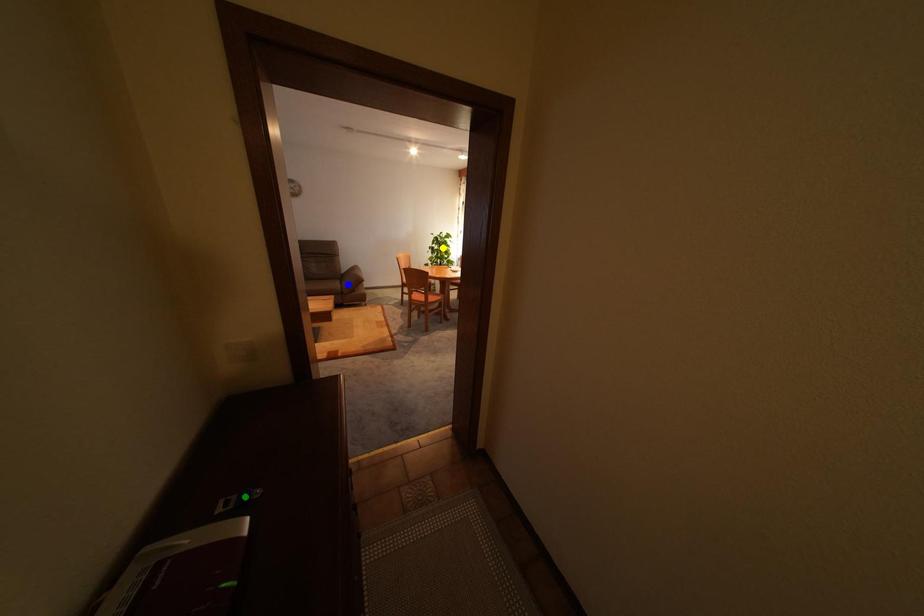
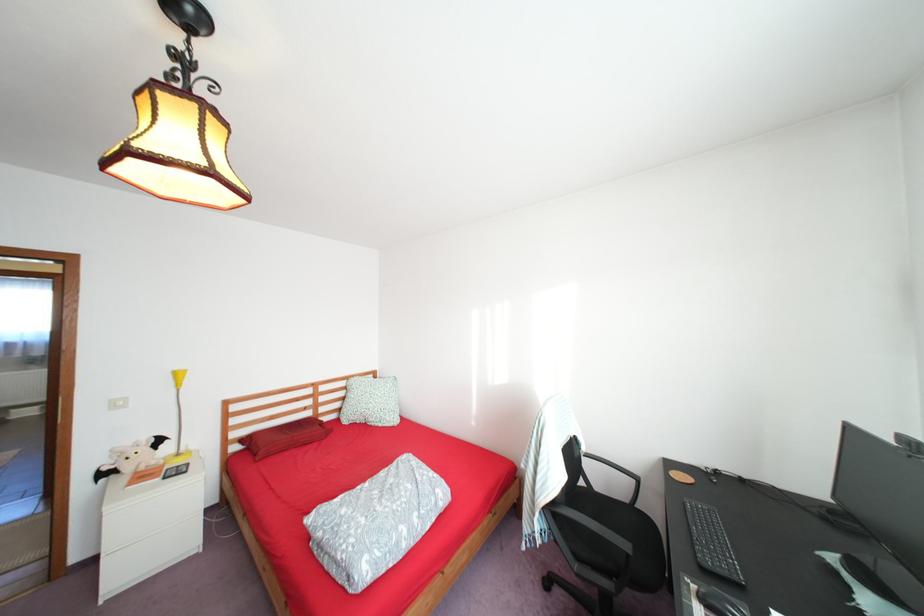
I am providing you with two images of the same scene from different viewpoints. Three points are marked in image1. Which point corresponds to a part or object that is occluded in image2?In image1, three points are marked. Which of them correspond to a part or object that is occluded in image2?Among the three points shown in image1, which one corresponds to a part or object that is no longer visible due to occlusion in image2?

yellow point, blue point, green point cannot be seen in image2.